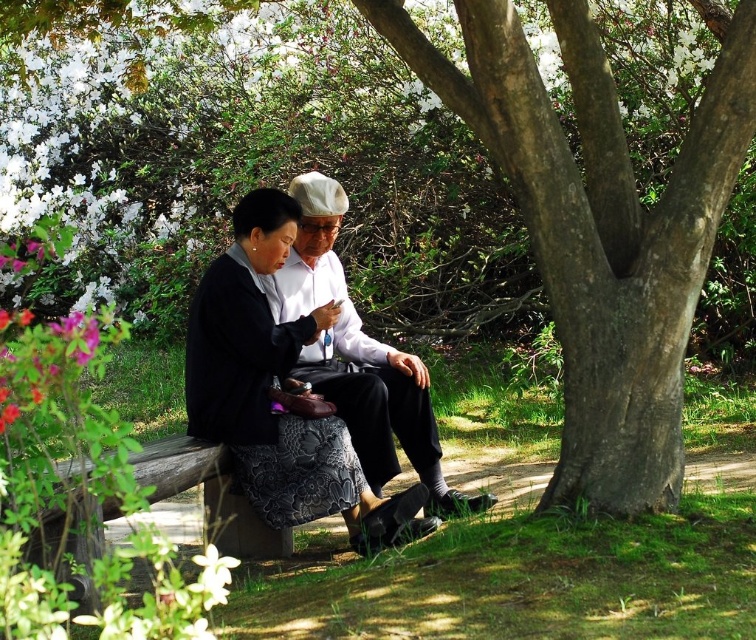
Question: Which object is closer to the camera taking this photo?

Choices:
 (A) matte black jacket at center
 (B) white cotton shirt at center
 (C) white matte flower at lower center

Answer: (C)

Question: Which point appears farthest from the camera in this image?

Choices:
 (A) (592, 365)
 (B) (243, 248)

Answer: (B)

Question: Which point is closer to the camera?

Choices:
 (A) (225, 584)
 (B) (248, 472)
 (C) (494, 26)
 (D) (330, 248)

Answer: (A)

Question: Does smooth bark tree at center have a greater width compared to matte black jacket at center?

Choices:
 (A) no
 (B) yes

Answer: (B)

Question: Considering the relative positions of matte black jacket at center and white cotton shirt at center in the image provided, where is matte black jacket at center located with respect to white cotton shirt at center?

Choices:
 (A) above
 (B) below

Answer: (B)

Question: Where is matte black jacket at center located in relation to white matte flower at lower center in the image?

Choices:
 (A) below
 (B) above

Answer: (B)